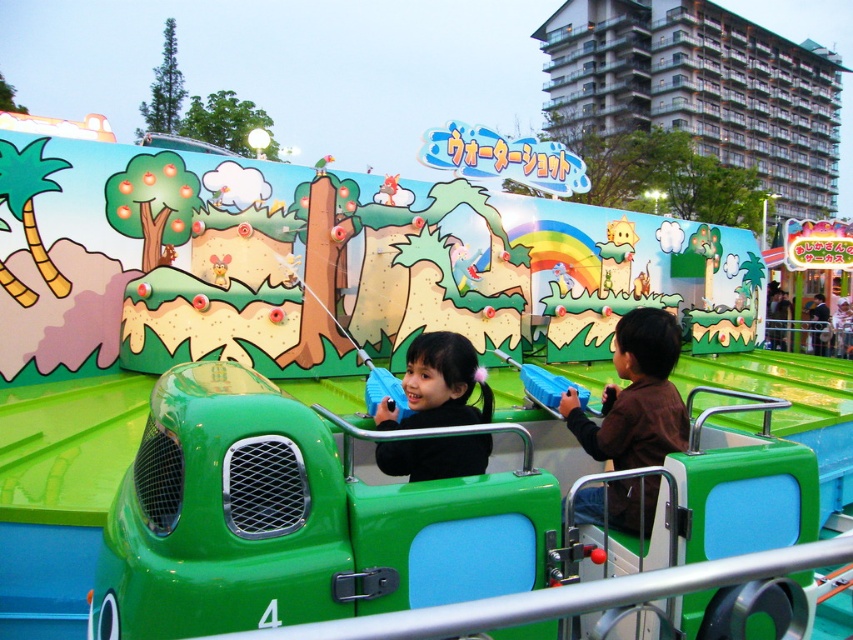
Is the position of brown matte jacket at center more distant than that of black matte jacket at center?

Yes, it is.

Is brown matte jacket at center positioned before black matte jacket at center?

No, brown matte jacket at center is behind black matte jacket at center.

Locate an element on the screen. The image size is (853, 640). brown matte jacket at center is located at coordinates (636, 396).